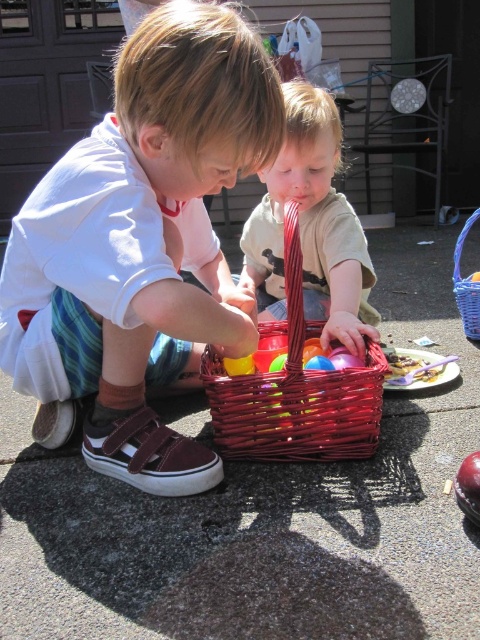
Which is below, matte white shirt at center or bright red wicker basket at center?

Positioned lower is bright red wicker basket at center.

Is point (264, 93) positioned before point (326, 376)?

Yes, point (264, 93) is closer to viewer.

The image size is (480, 640). I want to click on matte white shirt at center, so click(142, 244).

Is matte white shirt at center shorter than matte plastic toddler at center?

Incorrect, matte white shirt at center's height does not fall short of matte plastic toddler at center's.

Is point (167, 300) in front of point (326, 241)?

That is True.

From the picture: Who is more forward, (179, 253) or (261, 291)?

Positioned in front is point (179, 253).

Identify the location of matte white shirt at center. Image resolution: width=480 pixels, height=640 pixels. (142, 244).

Is point (300, 374) closer to viewer compared to point (467, 317)?

Yes, point (300, 374) is closer to viewer.

Does bright red wicker basket at center appear over woven wicker basket at center?

Incorrect, bright red wicker basket at center is not positioned above woven wicker basket at center.

Which is behind, point (291, 298) or point (464, 314)?

Point (464, 314)

Identify the location of bright red wicker basket at center. Image resolution: width=480 pixels, height=640 pixels. (296, 390).